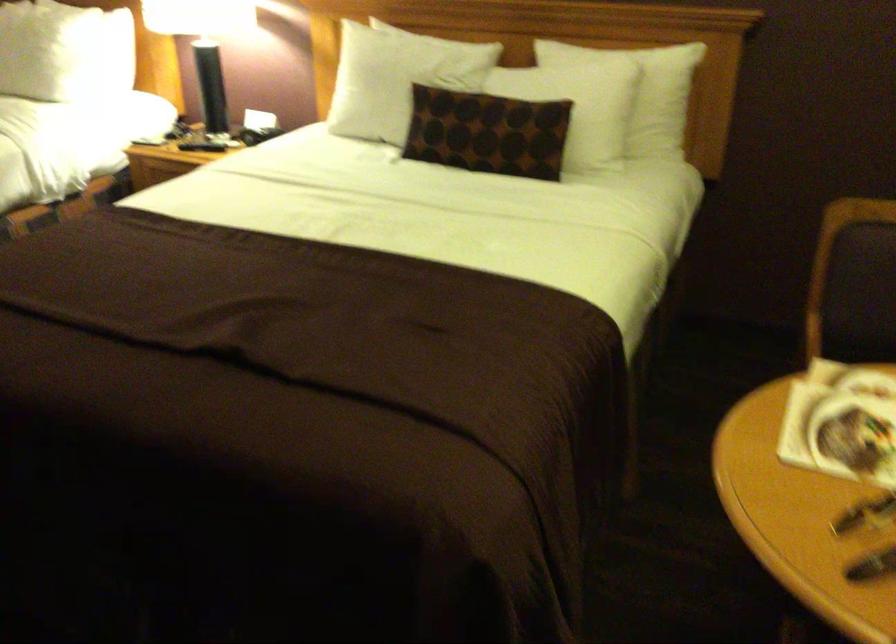
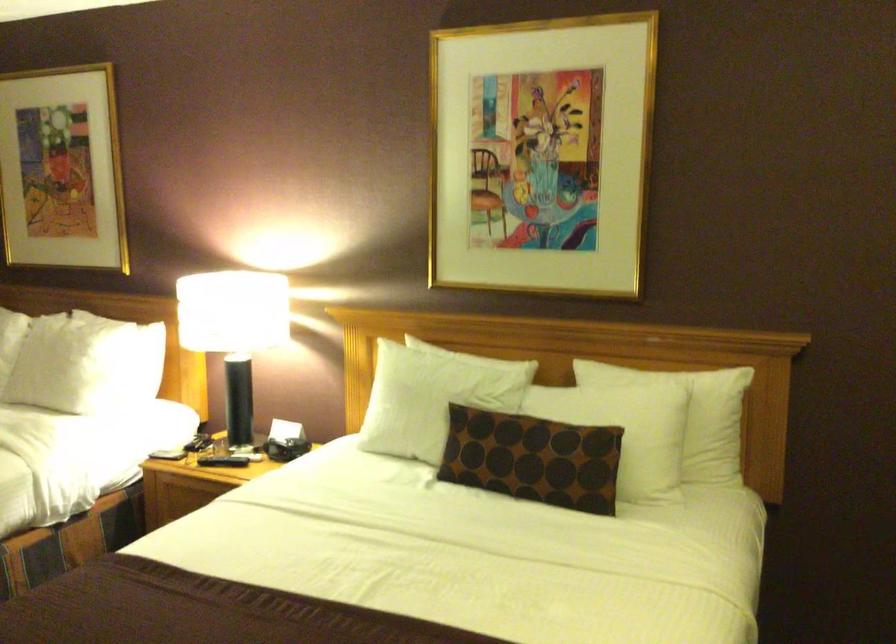
In the second image, find the point that corresponds to (389,98) in the first image.

(424, 418)